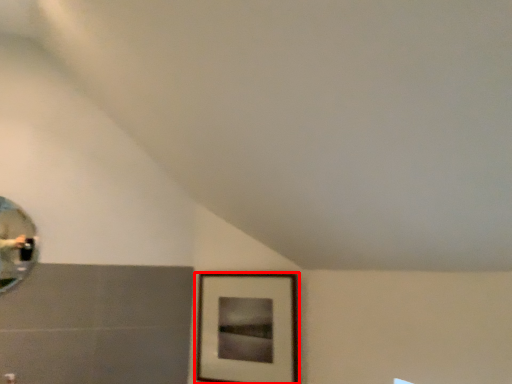
Question: In this image, where is picture frame (annotated by the red box) located relative to mirror?

Choices:
 (A) right
 (B) left

Answer: (A)